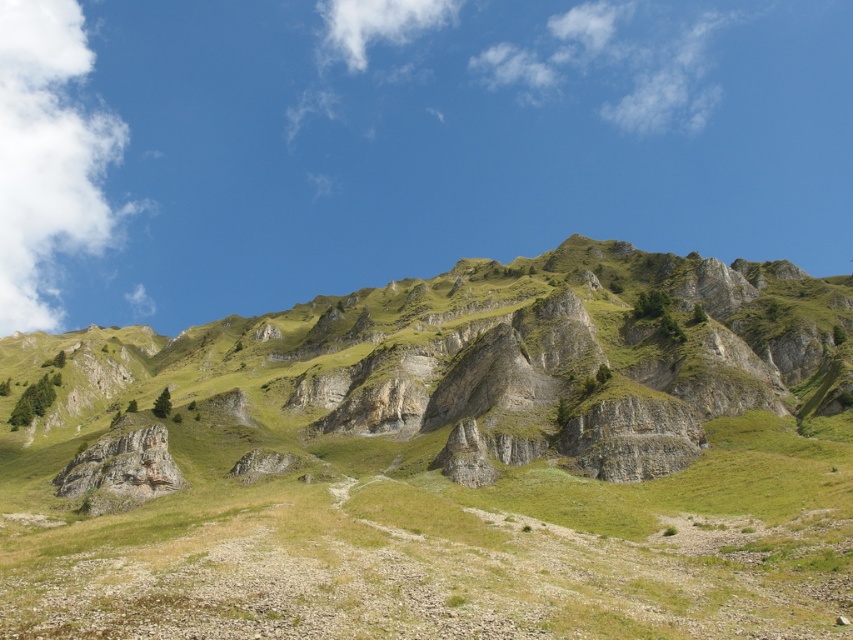
Based on the photo, does green grassy mountain at upper center have a larger size compared to white fluffy cloud at upper left?

No.

Is green grassy mountain at upper center below white fluffy cloud at upper left?

Yes, green grassy mountain at upper center is below white fluffy cloud at upper left.

This screenshot has height=640, width=853. I want to click on green grassy mountain at upper center, so click(x=445, y=460).

This screenshot has height=640, width=853. What are the coordinates of `green grassy mountain at upper center` in the screenshot? It's located at (445, 460).

Does white fluffy cloud at upper left have a greater width compared to white fluffy cloud at upper center?

Indeed, white fluffy cloud at upper left has a greater width compared to white fluffy cloud at upper center.

Describe the element at coordinates (47, 157) in the screenshot. I see `white fluffy cloud at upper left` at that location.

Image resolution: width=853 pixels, height=640 pixels. What do you see at coordinates (47, 157) in the screenshot?
I see `white fluffy cloud at upper left` at bounding box center [47, 157].

Locate an element on the screen. This screenshot has width=853, height=640. white fluffy cloud at upper left is located at coordinates (47, 157).

Can you confirm if green grassy mountain at upper center is positioned to the left of white fluffy cloud at upper center?

Incorrect, green grassy mountain at upper center is not on the left side of white fluffy cloud at upper center.

Which is in front, point (131, 512) or point (381, 16)?

Point (131, 512) is in front.

Find the location of a particular element. The image size is (853, 640). green grassy mountain at upper center is located at coordinates (445, 460).